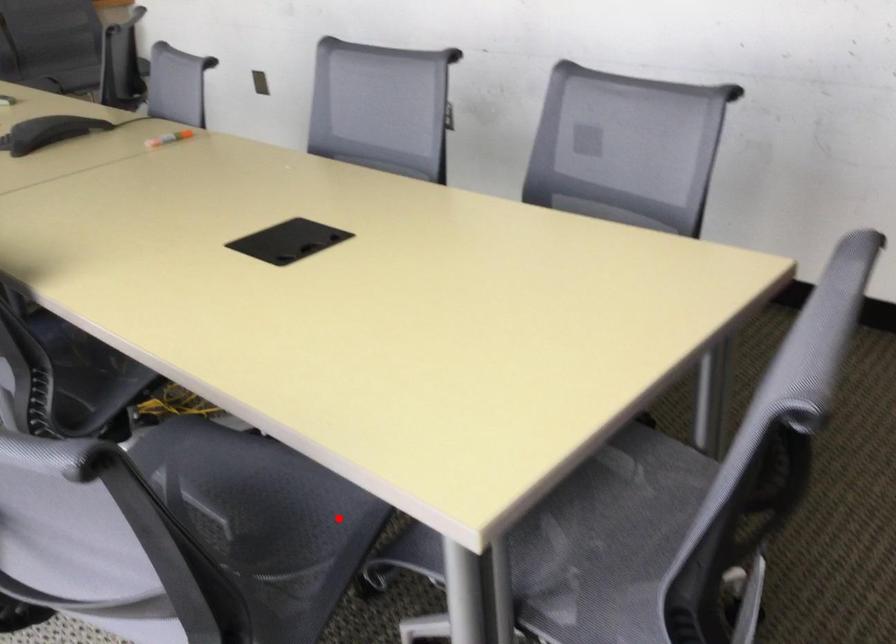
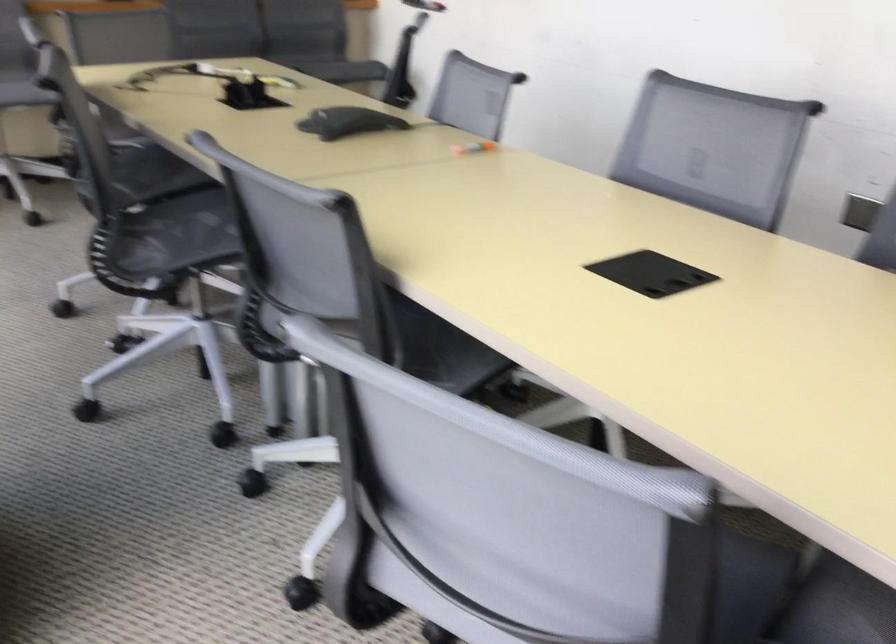
Where in the second image is the point corresponding to the highlighted location from the first image?

(718, 583)